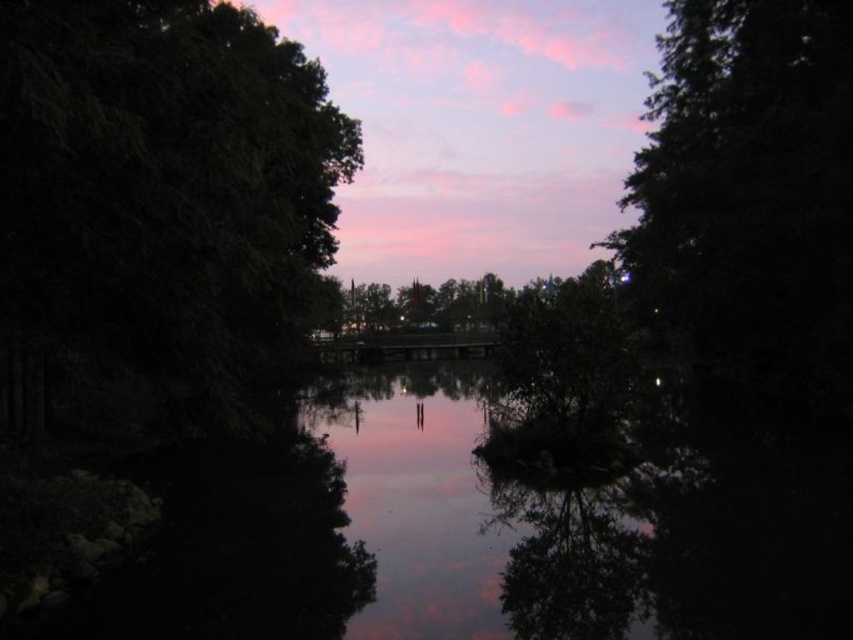
Question: Is green leafy tree at left above green matte tree at center?

Choices:
 (A) no
 (B) yes

Answer: (A)

Question: Is the position of green leafy tree at left more distant than that of dark green leafy tree at upper right?

Choices:
 (A) no
 (B) yes

Answer: (A)

Question: In this image, where is green leafy tree at left located relative to reflective glass water at center?

Choices:
 (A) below
 (B) above

Answer: (B)

Question: Based on their relative distances, which object is farther from the reflective glass water at center?

Choices:
 (A) green leafy tree at left
 (B) green matte tree at center
 (C) dark green leafy tree at upper right

Answer: (B)

Question: Which object is closer to the camera taking this photo?

Choices:
 (A) dark green leafy tree at upper right
 (B) green leafy tree at left

Answer: (B)

Question: Which point is farther from the camera taking this photo?

Choices:
 (A) (338, 440)
 (B) (839, 3)

Answer: (B)